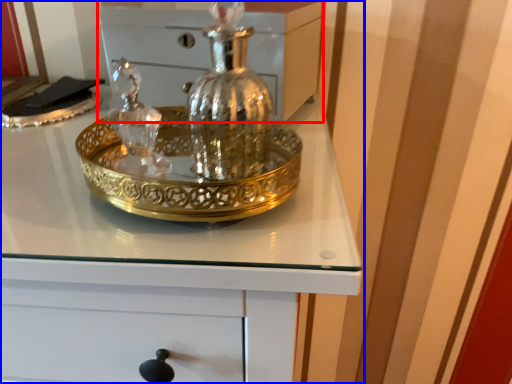
Question: Which point is closer to the camera, chest (highlighted by a red box) or chest of drawers (highlighted by a blue box)?

Choices:
 (A) chest
 (B) chest of drawers

Answer: (B)